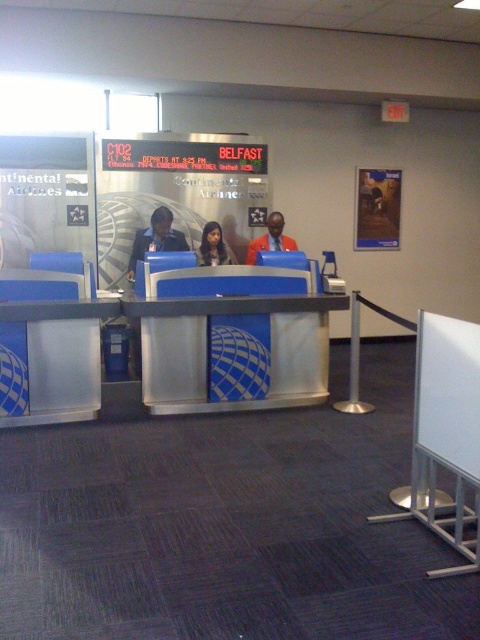
Between blue fabric uniform at center and smooth skin face at center, which one appears on the left side from the viewer's perspective?

Positioned to the left is blue fabric uniform at center.

Where is `blue fabric uniform at center`? The width and height of the screenshot is (480, 640). blue fabric uniform at center is located at coordinates (156, 237).

Who is shorter, orange fabric jacket at center or smooth skin face at center?

Standing shorter between the two is smooth skin face at center.

Between point (261, 241) and point (200, 253), which one is positioned behind?

Positioned behind is point (261, 241).

Which is behind, point (288, 246) or point (231, 260)?

Point (288, 246)

The height and width of the screenshot is (640, 480). Identify the location of orange fabric jacket at center. (271, 237).

Who is taller, blue fabric uniform at center or orange fabric jacket at center?

Standing taller between the two is blue fabric uniform at center.

The image size is (480, 640). In order to click on blue fabric uniform at center in this screenshot , I will do `click(156, 237)`.

Between point (133, 259) and point (268, 248), which one is positioned in front?

Point (133, 259) is in front.

Where is `blue fabric uniform at center`? blue fabric uniform at center is located at coordinates (156, 237).